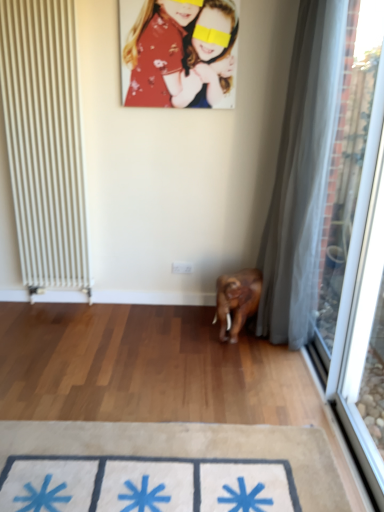
At what (x,y) coordinates should I click in order to perform the action: click on free space in front of white metal radiator at left. Please return your answer as a coordinate pair (x, y). Looking at the image, I should click on (49, 322).